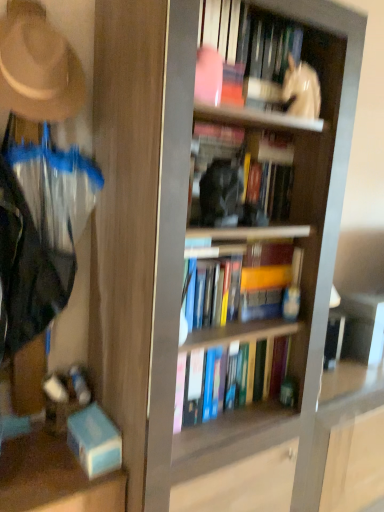
Question: Considering the positions of hardcover book at center, arranged as the 2th book when viewed from the top, and hardcover books at center, the first book when ordered from bottom to top, in the image, is hardcover book at center, arranged as the 2th book when viewed from the top, wider or thinner than hardcover books at center, the first book when ordered from bottom to top,?

Choices:
 (A) thin
 (B) wide

Answer: (A)

Question: From the image's perspective, relative to hardcover books at center, arranged as the 4th book when viewed from the top, is hardcover book at center, arranged as the 2th book when viewed from the top, above or below?

Choices:
 (A) above
 (B) below

Answer: (A)

Question: Which of these objects is positioned farthest from the hardcover books at center, arranged as the 4th book when viewed from the top?

Choices:
 (A) white glossy statue at upper center, which ranks as the 4th book in bottom-to-top order
 (B) clear plastic screen door at left
 (C) hardcover book at center, arranged as the 2th book when viewed from the top
 (D) beige felt hat at upper left
 (E) hardcover book at center, acting as the second book starting from the bottom

Answer: (D)

Question: Considering the real-world distances, which object is farthest from the white glossy statue at upper center?

Choices:
 (A) hardcover books at center, arranged as the 4th book when viewed from the top
 (B) clear plastic screen door at left
 (C) hardcover book at center, the third book when ordered from bottom to top
 (D) beige felt hat at upper left
 (E) hardcover book at center, acting as the second book starting from the bottom

Answer: (B)